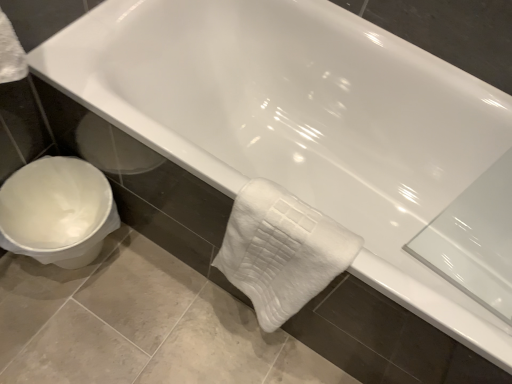
You are a GUI agent. You are given a task and a screenshot of the screen. Output one action in this format:
    pyautogui.click(x=<x>, y=<y>)
    Task: Click on the free spot in front of white plastic toilet at lower left
    Image resolution: width=512 pixels, height=384 pixels.
    Given the screenshot: What is the action you would take?
    pyautogui.click(x=50, y=329)